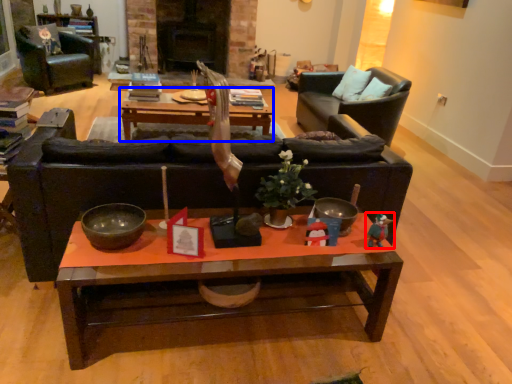
Question: Which object appears closest to the camera in this image, toy (highlighted by a red box) or coffee table (highlighted by a blue box)?

Choices:
 (A) toy
 (B) coffee table

Answer: (A)